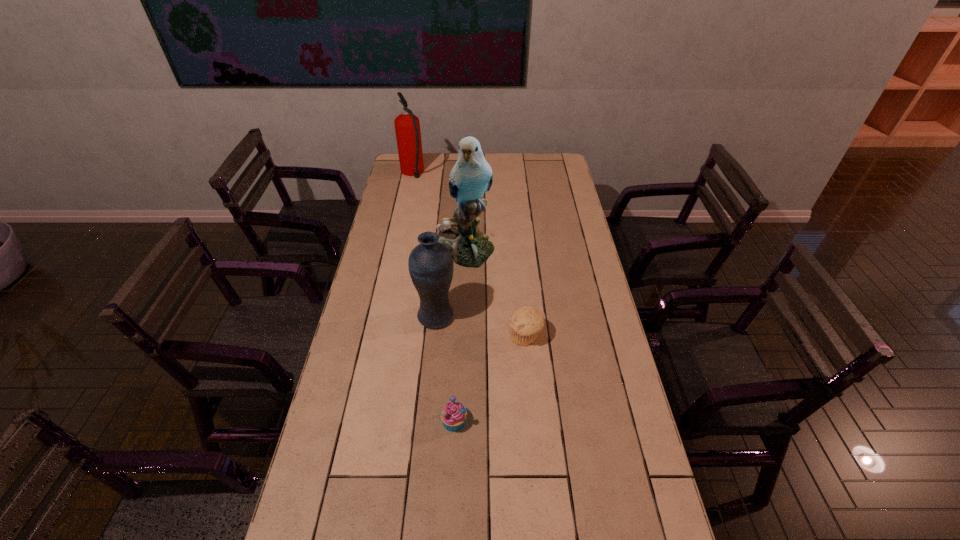
Locate an element on the screen. The height and width of the screenshot is (540, 960). the tallest object is located at coordinates (471, 176).

The width and height of the screenshot is (960, 540). In order to click on the second farthest object in this screenshot , I will do point(471,176).

The height and width of the screenshot is (540, 960). I want to click on the farthest object, so click(x=407, y=126).

Where is `the leftmost object`? This screenshot has width=960, height=540. the leftmost object is located at coordinates (407, 126).

Where is `vase`? vase is located at coordinates (430, 263).

I want to click on the second shortest object, so (526, 322).

Locate an element on the screen. This screenshot has height=540, width=960. the rightmost object is located at coordinates (526, 322).

Locate an element on the screen. Image resolution: width=960 pixels, height=540 pixels. the shortest object is located at coordinates (453, 415).

The image size is (960, 540). I want to click on the nearer muffin, so click(x=453, y=415).

The width and height of the screenshot is (960, 540). Identify the location of blank space located on the face of the tallest object. (463, 301).